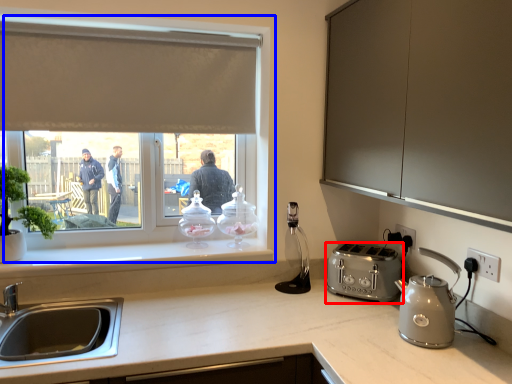
Question: Which object appears farthest to the camera in this image, toaster (highlighted by a red box) or window (highlighted by a blue box)?

Choices:
 (A) toaster
 (B) window

Answer: (B)